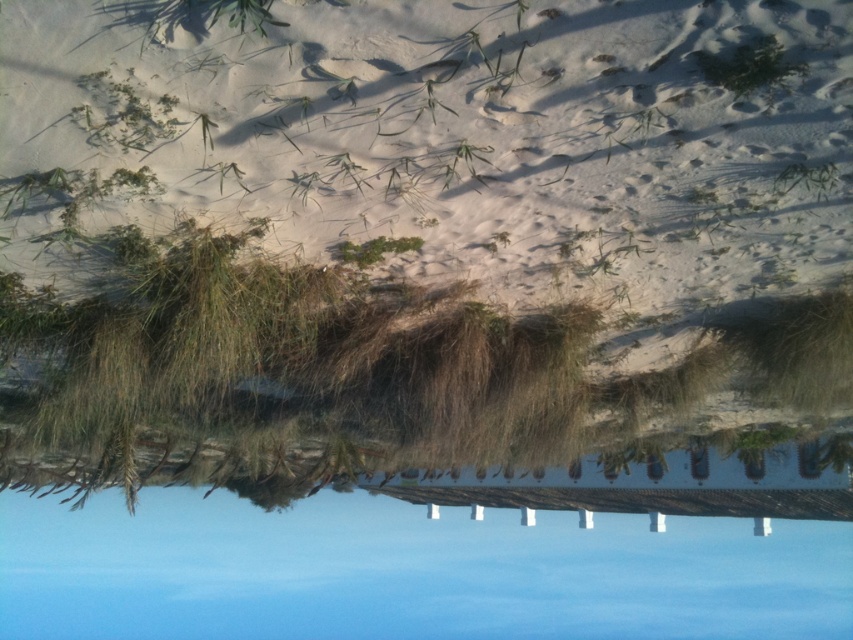
Question: Among these points, which one is farthest from the camera?

Choices:
 (A) (170, 570)
 (B) (18, 237)

Answer: (A)

Question: Is white fluffy snow at center bigger than blue glass lake at center?

Choices:
 (A) no
 (B) yes

Answer: (A)

Question: Which object appears farthest from the camera in this image?

Choices:
 (A) white fluffy snow at center
 (B) blue glass lake at center

Answer: (B)

Question: Is white fluffy snow at center wider than blue glass lake at center?

Choices:
 (A) yes
 (B) no

Answer: (B)

Question: Can you confirm if white fluffy snow at center is positioned above blue glass lake at center?

Choices:
 (A) no
 (B) yes

Answer: (B)